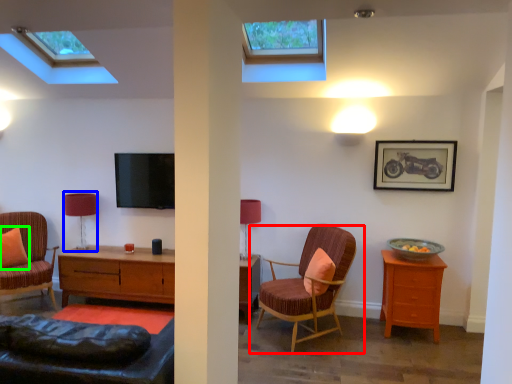
Question: Estimate the real-world distances between objects in this image. Which object is closer to chair (highlighted by a red box), table lamp (highlighted by a blue box) or pillow (highlighted by a green box)?

Choices:
 (A) table lamp
 (B) pillow

Answer: (A)